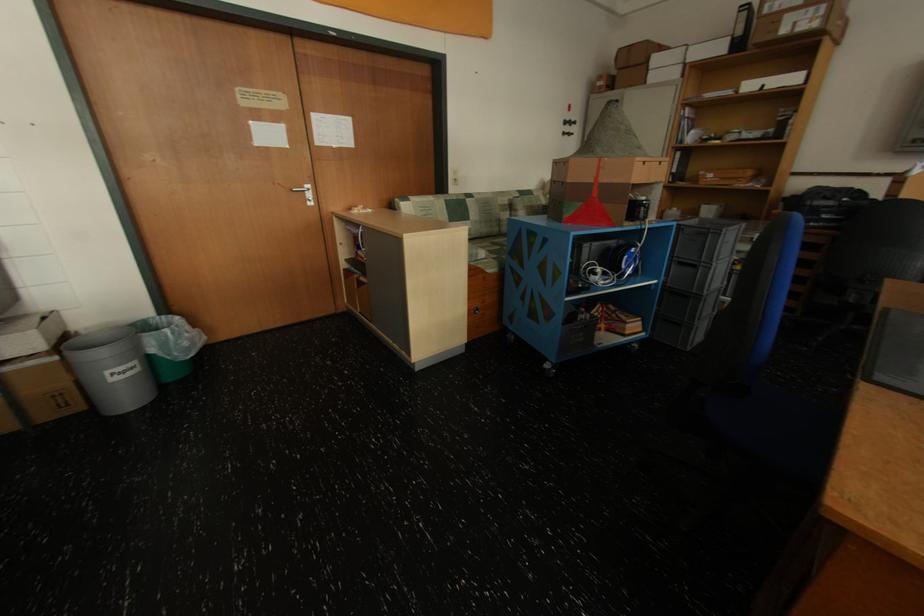
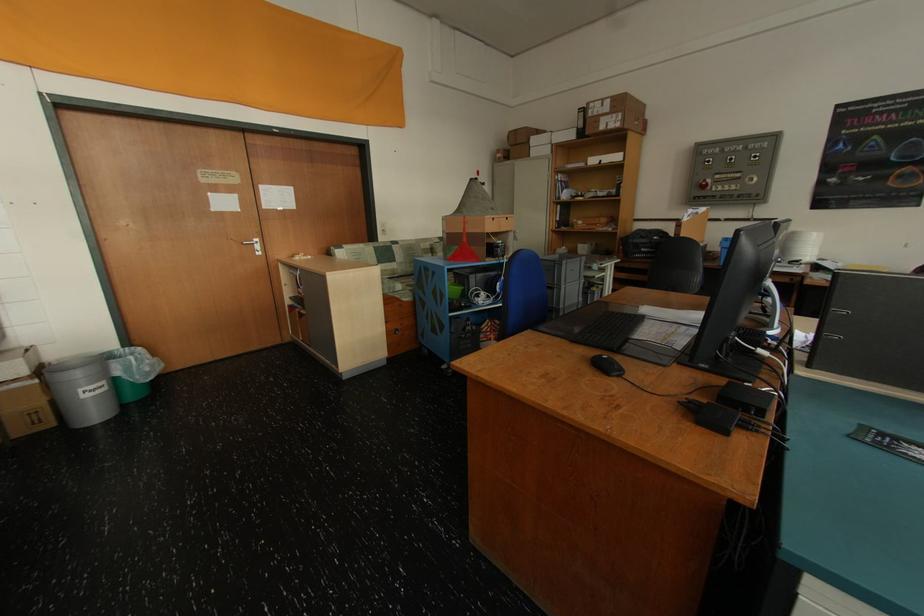
Find the pixel in the second image that matches (176,331) in the first image.

(140, 359)